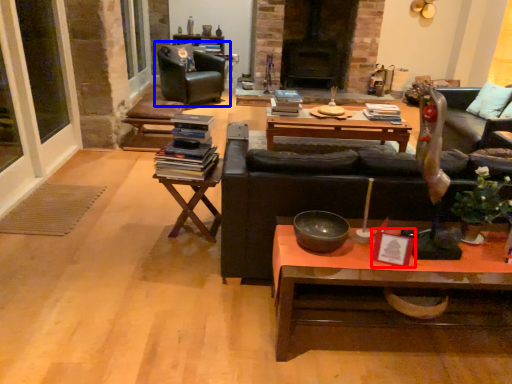
Question: Which object appears closest to the camera in this image, picture frame (highlighted by a red box) or chair (highlighted by a blue box)?

Choices:
 (A) picture frame
 (B) chair

Answer: (A)